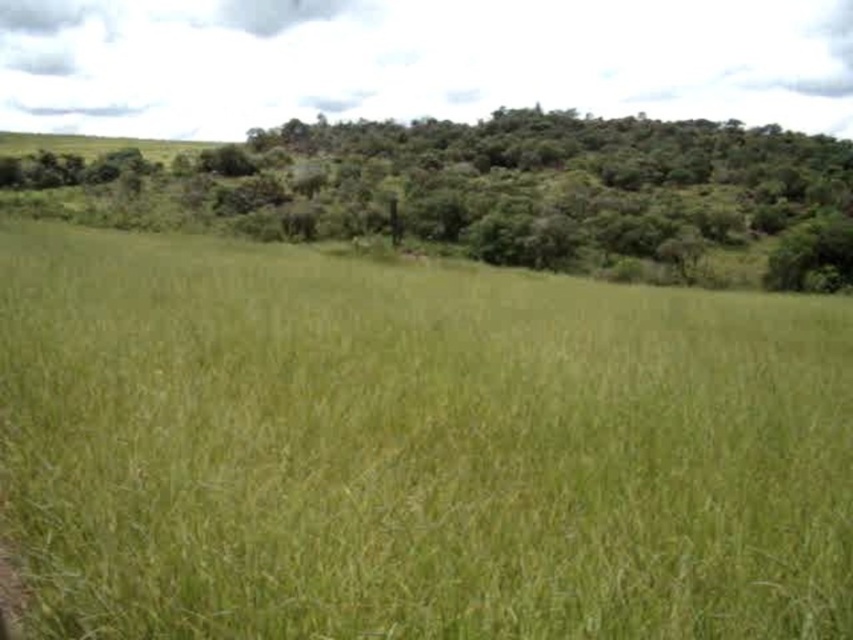
Question: In this image, where is green grassy field at center located relative to green leafy tree at upper center?

Choices:
 (A) below
 (B) above

Answer: (A)

Question: Can you confirm if green grassy field at center is positioned to the left of green leafy tree at upper center?

Choices:
 (A) yes
 (B) no

Answer: (B)

Question: Which of the following is the farthest from the observer?

Choices:
 (A) (535, 176)
 (B) (486, 628)

Answer: (A)

Question: Is green grassy field at center wider than green leafy tree at upper center?

Choices:
 (A) yes
 (B) no

Answer: (B)

Question: Which point appears farthest from the camera in this image?

Choices:
 (A) click(846, 416)
 (B) click(595, 150)

Answer: (B)